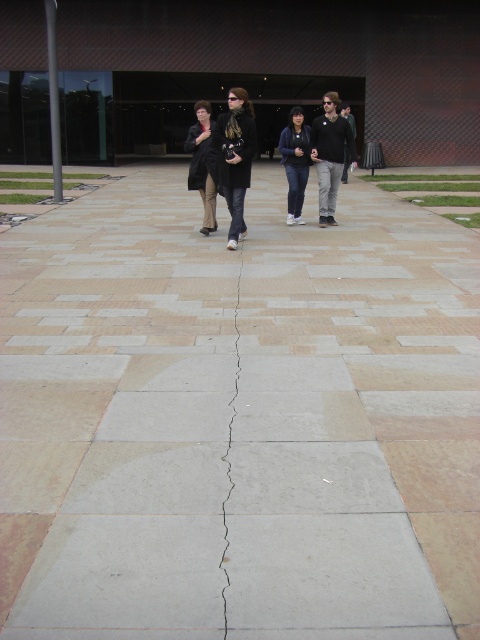
You are standing on the paved area with the dark gray sweater at center and the dark brown leather jacket at center. Which item is closer to you?

The dark gray sweater at center is closer to you because it is further to the viewer than the dark brown leather jacket at center.

You are a delivery person carrying a large package and need to walk through the paved area with the vertical crack. You see the dark gray sweater at center and the dark brown leather jacket at center. Which item of clothing should you avoid stepping on to ensure you can navigate the narrow path near the crack?

You should avoid stepping on the dark gray sweater at center because it occupies less space than the dark brown leather jacket at center, making it a narrower area to navigate around.

You are a delivery person who needs to place a package on the ground. The package must be placed exactly at the center of the paved area. However, there is a black matte coat at center in the way. Can you place the package at the center without moving the coat?

The black matte coat at center is located at point (236, 157), which is not exactly the center of the paved area. Therefore, you can place the package at the true center without moving the coat.